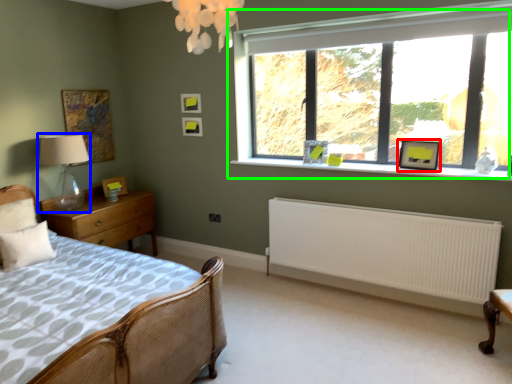
Question: Which object is positioned closest to picture frame (highlighted by a red box)? Select from table lamp (highlighted by a blue box) and window (highlighted by a green box).

Choices:
 (A) table lamp
 (B) window

Answer: (B)